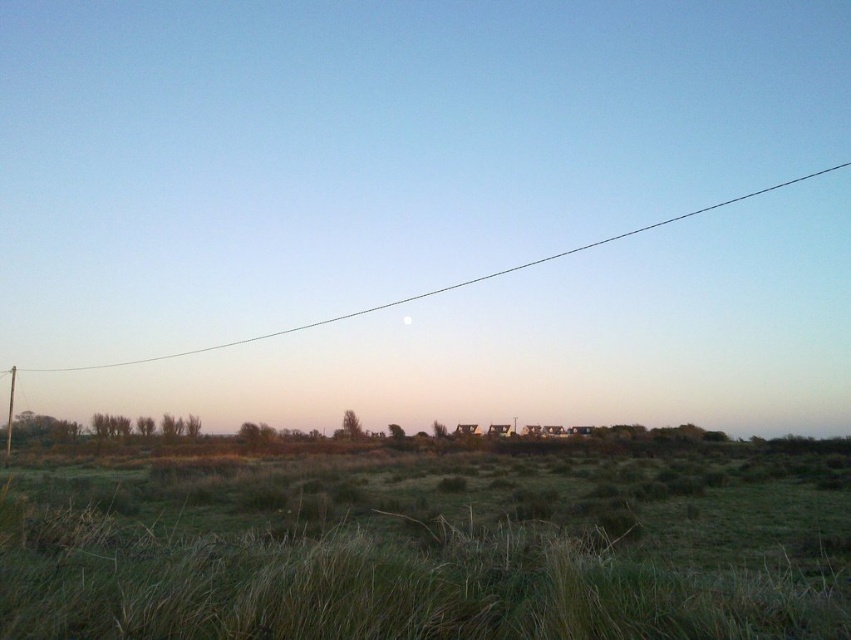
Which of these two, clear wire at upper center or white glossy moon at upper center, stands shorter?

white glossy moon at upper center is shorter.

Consider the image. Who is positioned more to the left, clear wire at upper center or white glossy moon at upper center?

From the viewer's perspective, white glossy moon at upper center appears more on the left side.

Which is in front, point (724, 204) or point (409, 323)?

Point (409, 323)

What are the coordinates of `clear wire at upper center` in the screenshot? It's located at (441, 285).

Which is below, green grassy at lower center or clear wire at upper center?

green grassy at lower center

Can you confirm if green grassy at lower center is taller than clear wire at upper center?

No, green grassy at lower center is not taller than clear wire at upper center.

The image size is (851, 640). What do you see at coordinates (413, 561) in the screenshot?
I see `green grassy at lower center` at bounding box center [413, 561].

You are a GUI agent. You are given a task and a screenshot of the screen. Output one action in this format:
    pyautogui.click(x=<x>, y=<y>)
    Task: Click on the green grassy at lower center
    The width and height of the screenshot is (851, 640).
    Given the screenshot: What is the action you would take?
    pyautogui.click(x=413, y=561)

Which is behind, point (465, 561) or point (410, 321)?

The point (410, 321) is behind.

Does green grassy at lower center appear on the left side of white glossy moon at upper center?

No, green grassy at lower center is not to the left of white glossy moon at upper center.

Does point (758, 604) come closer to viewer compared to point (407, 321)?

Yes.

Identify the location of green grassy at lower center. (413, 561).